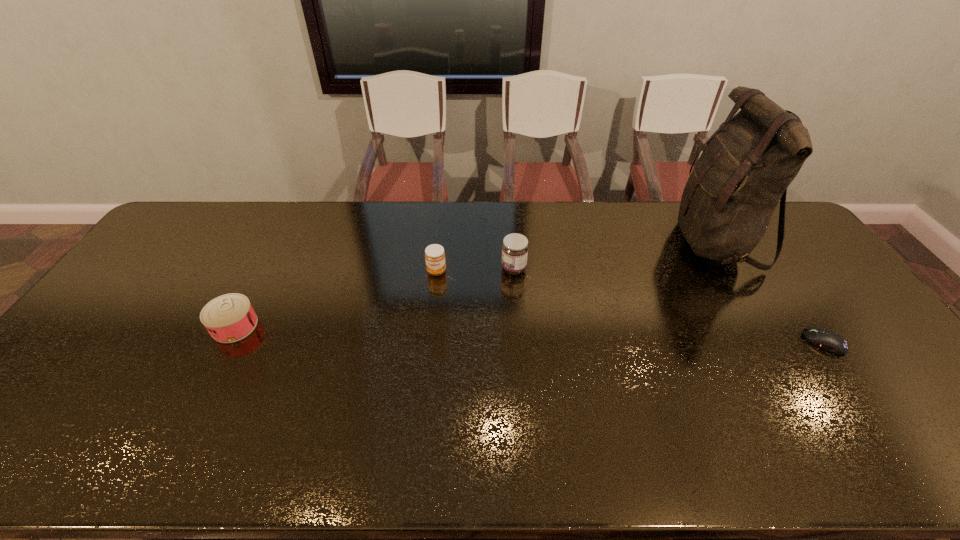
Locate an element on the screen. backpack is located at coordinates (745, 169).

You are a GUI agent. You are given a task and a screenshot of the screen. Output one action in this format:
    pyautogui.click(x=<x>, y=<y>)
    Task: Click on the fourth shortest object
    The height and width of the screenshot is (540, 960).
    Given the screenshot: What is the action you would take?
    pyautogui.click(x=515, y=247)

The image size is (960, 540). I want to click on the third object from right to left, so click(x=515, y=247).

Find the location of a particular element. The image size is (960, 540). the shorter jam is located at coordinates tap(435, 261).

Where is `the left jam`? Image resolution: width=960 pixels, height=540 pixels. the left jam is located at coordinates (435, 261).

The height and width of the screenshot is (540, 960). In order to click on the leftmost object in this screenshot , I will do `click(228, 318)`.

Where is `the second shortest object`? The height and width of the screenshot is (540, 960). the second shortest object is located at coordinates (228, 318).

At what (x,y) coordinates should I click in order to perform the action: click on computer equipment. Please return your answer as a coordinate pair (x, y). Looking at the image, I should click on (833, 342).

Locate an element on the screen. Image resolution: width=960 pixels, height=540 pixels. free location located 0.390m on the open flap of the backpack is located at coordinates (559, 241).

Find the location of a particular element. The height and width of the screenshot is (540, 960). free space located 0.140m on the open flap of the backpack is located at coordinates (633, 241).